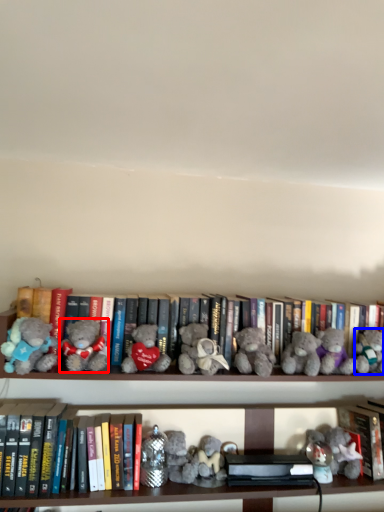
Question: Which object appears farthest to the camera in this image, teddy bear (highlighted by a red box) or toy (highlighted by a blue box)?

Choices:
 (A) teddy bear
 (B) toy

Answer: (B)